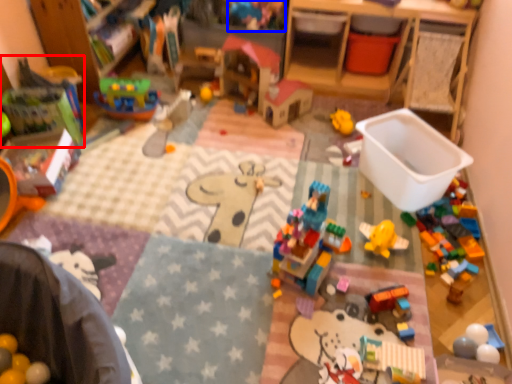
Question: Which point is further to the camera, toy (highlighted by a red box) or toy (highlighted by a blue box)?

Choices:
 (A) toy
 (B) toy

Answer: (B)